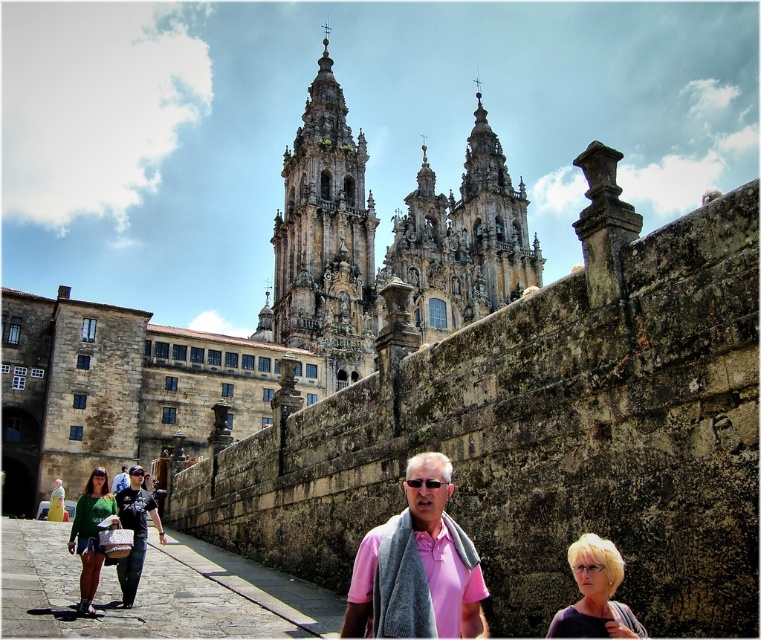
You are standing in front of the cathedral and see a person with blonde hair at lower right and another wearing pink fabric at center. Which person is nearer to you?

The blonde hair at lower right is closer to the viewer than the pink fabric at center, so the person with blonde hair at lower right is nearer.